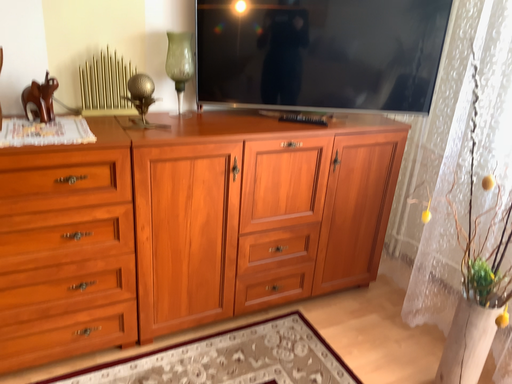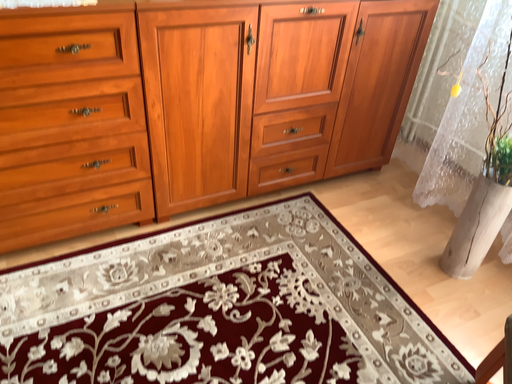
Question: Which way did the camera rotate in the video?

Choices:
 (A) rotated downward
 (B) rotated upward

Answer: (A)